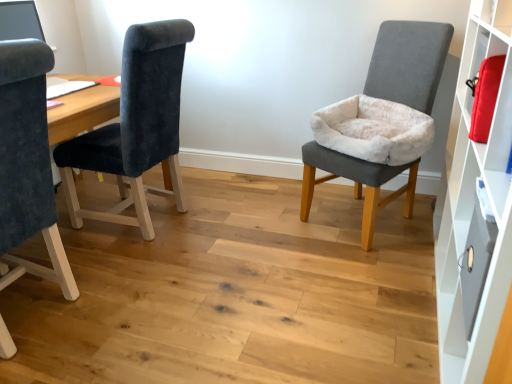
Identify the location of free space that is in between velvet gray chair at right, the first chair viewed from the right, and velvet dark blue chair at left, the third chair viewed from the right. The width and height of the screenshot is (512, 384). (227, 260).